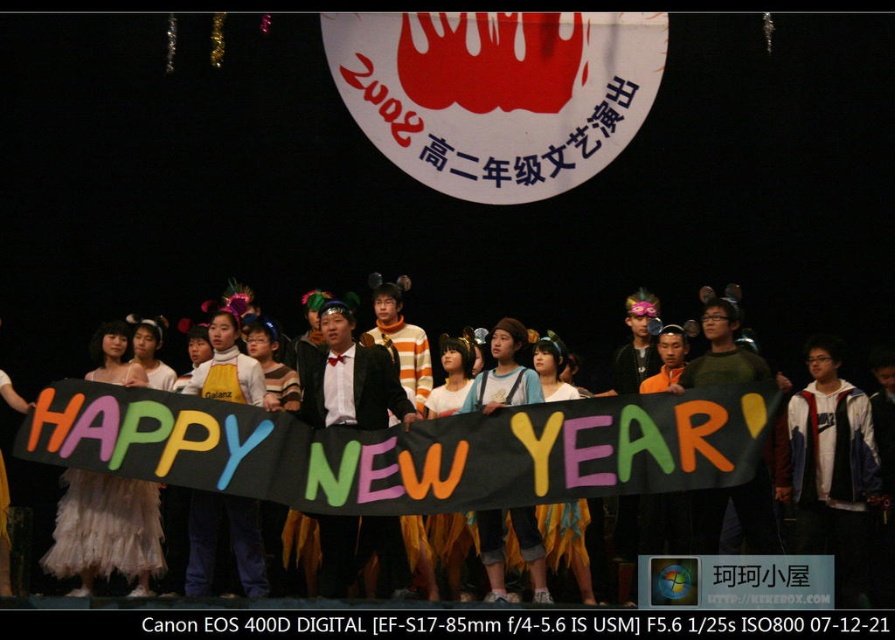
Question: Among these objects, which one is farthest from the camera?

Choices:
 (A) white matte dress at center
 (B) white fluffy dress at center

Answer: (B)

Question: Does white matte dress at center come behind white fluffy dress at center?

Choices:
 (A) no
 (B) yes

Answer: (A)

Question: From the image, what is the correct spatial relationship of white matte dress at center in relation to white fluffy dress at center?

Choices:
 (A) above
 (B) below

Answer: (A)

Question: Does white matte dress at center have a greater width compared to white fluffy dress at center?

Choices:
 (A) yes
 (B) no

Answer: (A)